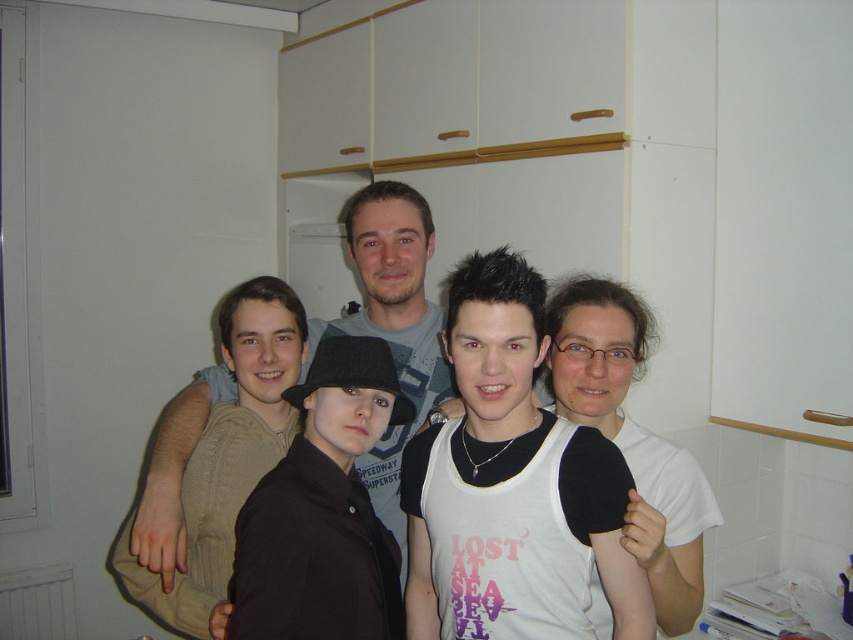
You are standing in the kitchen and see two items at the center of the scene. The black matte hat at center and the matte gray shirt at center. Which one is positioned more to the right?

The black matte hat at center is positioned more to the right than the matte gray shirt at center.

You are a photographer trying to adjust the lighting for a photo shoot in the kitchen. You notice the black matte hat at center and the matte gray shirt at center are too close together. What is the minimum distance you need to move one of them to ensure they are at least 15 inches apart?

The black matte hat at center and the matte gray shirt at center are currently 12.59 inches apart. To reach the desired 15 inches, you need to move one of them at least 2.41 inches away from the current position.